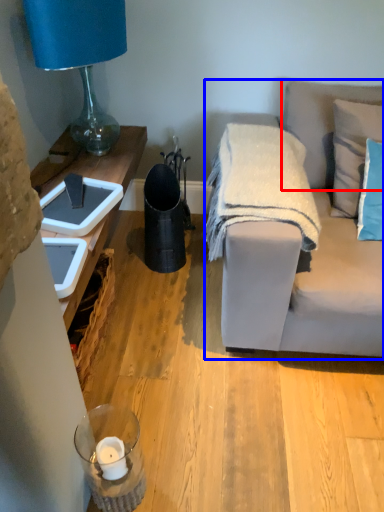
Question: Which object is closer to the camera taking this photo, pillow (highlighted by a red box) or studio couch (highlighted by a blue box)?

Choices:
 (A) pillow
 (B) studio couch

Answer: (B)